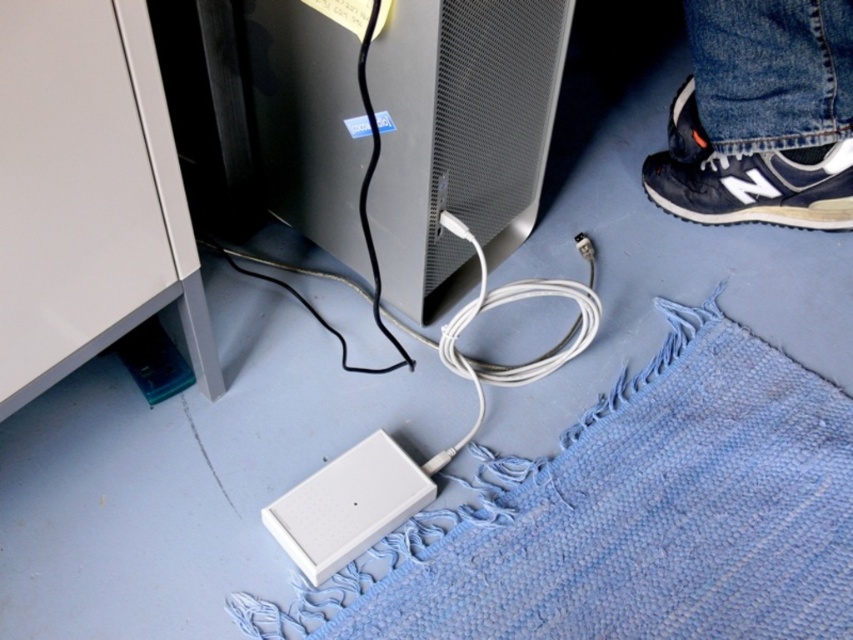
Question: Which point is farther to the camera?

Choices:
 (A) (811, 118)
 (B) (409, 253)

Answer: (A)

Question: Can you confirm if satin black monitor at center is wider than black leather shoe at lower right?

Choices:
 (A) yes
 (B) no

Answer: (A)

Question: Does satin black monitor at center have a larger size compared to black leather shoe at lower right?

Choices:
 (A) yes
 (B) no

Answer: (A)

Question: Does satin black monitor at center appear over black leather shoe at lower right?

Choices:
 (A) yes
 (B) no

Answer: (B)

Question: Which of the following is the farthest from the observer?

Choices:
 (A) (341, 164)
 (B) (727, 0)

Answer: (B)